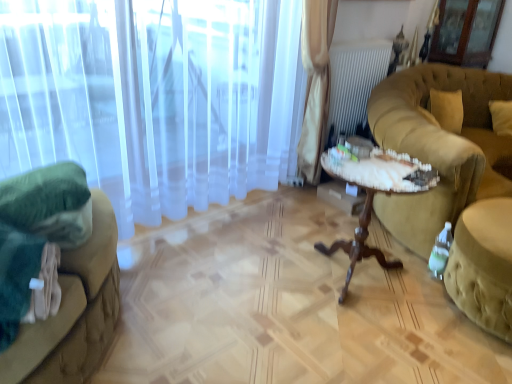
Locate an element on the screen. The height and width of the screenshot is (384, 512). vacant space situated on the left part of woodenwoodentable at right is located at coordinates (264, 277).